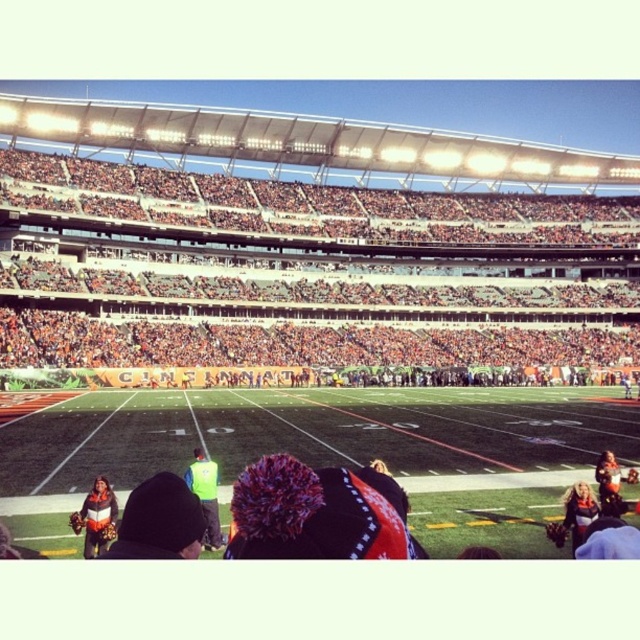
Between neon yellow vest at center and orange jersey at lower right, which one has more height?

neon yellow vest at center is taller.

Who is more distant from viewer, [196,467] or [620,499]?

Point [620,499]

You are a GUI agent. You are given a task and a screenshot of the screen. Output one action in this format:
    pyautogui.click(x=<x>, y=<y>)
    Task: Click on the neon yellow vest at center
    This screenshot has width=640, height=640.
    Given the screenshot: What is the action you would take?
    pyautogui.click(x=205, y=496)

Who is taller, orange fabric seats at upper center or orange and white striped jacket at lower left?

orange fabric seats at upper center is taller.

Is point (586, 275) less distant than point (129, 518)?

No, (586, 275) is further to viewer.

Find the location of `orange fabric seats at upper center`. orange fabric seats at upper center is located at coordinates (305, 273).

Does orange and white striped jacket at lower left have a smaller size compared to striped sweater at lower left?

Correct, orange and white striped jacket at lower left occupies less space than striped sweater at lower left.

Is orange and white striped jacket at lower left positioned in front of striped sweater at lower left?

Yes, it is.

Between point (179, 540) and point (88, 496), which one is positioned in front?

Point (179, 540)

This screenshot has height=640, width=640. Find the location of `orange and white striped jacket at lower left`. orange and white striped jacket at lower left is located at coordinates (160, 522).